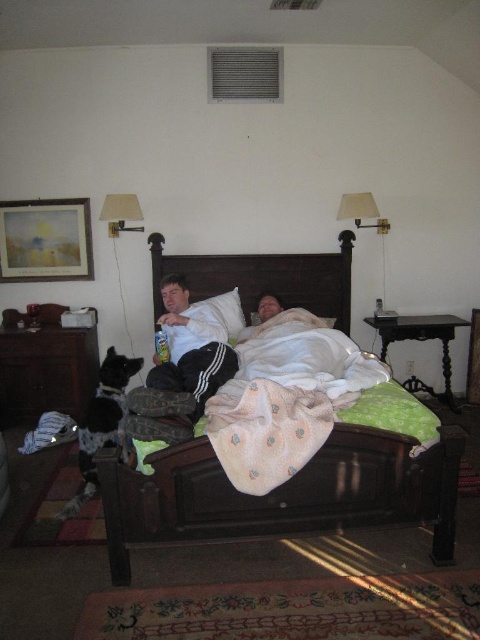
You are trying to decide whether to place a small decorative pillow between the light pink soft fabric blanket at center and the white matte shirt at center. Based on their sizes, which object should the pillow be closer to?

The light pink soft fabric blanket at center is larger in size than the white matte shirt at center, so the pillow should be placed closer to the blanket to ensure it fits well.

You are a photographer taking a picture of the light pink soft fabric blanket at center and the white matte shirt at center. To frame them properly, you need to know their positions relative to each other. Which object is positioned to the right of the other?

The light pink soft fabric blanket at center is to the right of the white matte shirt at center.

You are standing in the bedroom and want to place a small decorative item on the closest object between the dark wood headboard at center and the white soft pillow at center. Which object should you choose?

You should place the decorative item on the white soft pillow at center because it is closer to you than the dark wood headboard at center, which is further away.